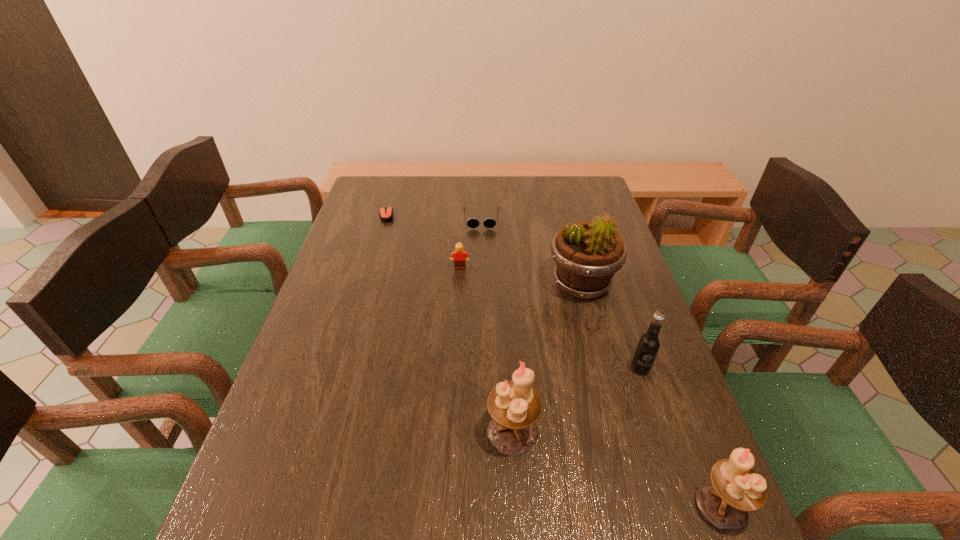
Locate an element on the screen. This screenshot has width=960, height=540. the second nearest object is located at coordinates (515, 406).

The width and height of the screenshot is (960, 540). Find the location of `the taller candle holder`. the taller candle holder is located at coordinates (515, 406).

At what (x,y) coordinates should I click in order to perform the action: click on the nearer candle holder. Please return your answer as a coordinate pair (x, y). This screenshot has width=960, height=540. Looking at the image, I should click on (735, 488).

Where is `the nearest object`? The width and height of the screenshot is (960, 540). the nearest object is located at coordinates point(735,488).

What are the coordinates of `the leftmost object` in the screenshot? It's located at (386, 213).

Identify the location of the shortest object. (386, 213).

Find the location of a particular element. The width and height of the screenshot is (960, 540). sunglasses is located at coordinates (472, 222).

At what (x,y) coordinates should I click in order to perform the action: click on the fifth tallest object. Please return your answer as a coordinate pair (x, y). This screenshot has height=540, width=960. Looking at the image, I should click on (459, 254).

Identify the location of the third nearest object. The image size is (960, 540). (648, 345).

Locate an element on the screen. This screenshot has width=960, height=540. flowerpot is located at coordinates (587, 254).